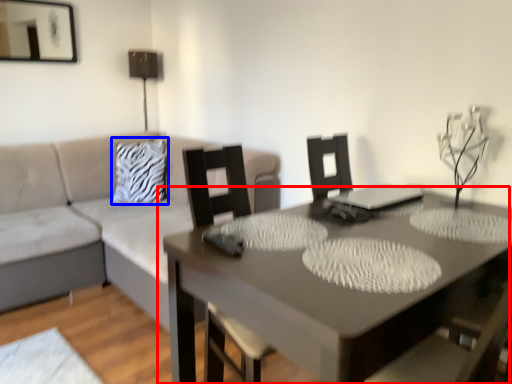
Question: Which point is further to the camera, table (highlighted by a red box) or pillow (highlighted by a blue box)?

Choices:
 (A) table
 (B) pillow

Answer: (B)